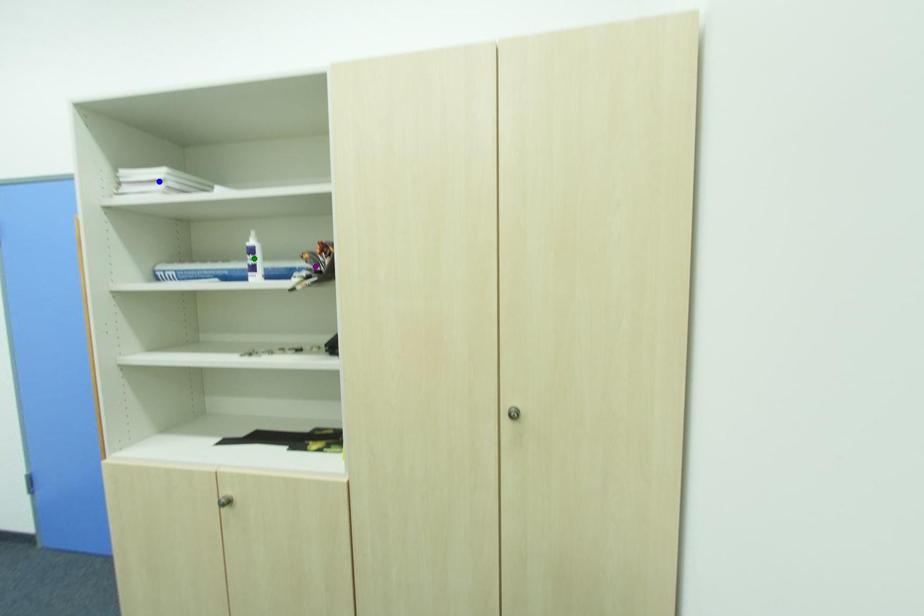
Order these from nearest to farthest:
A) purple point
B) green point
C) blue point

purple point → blue point → green point